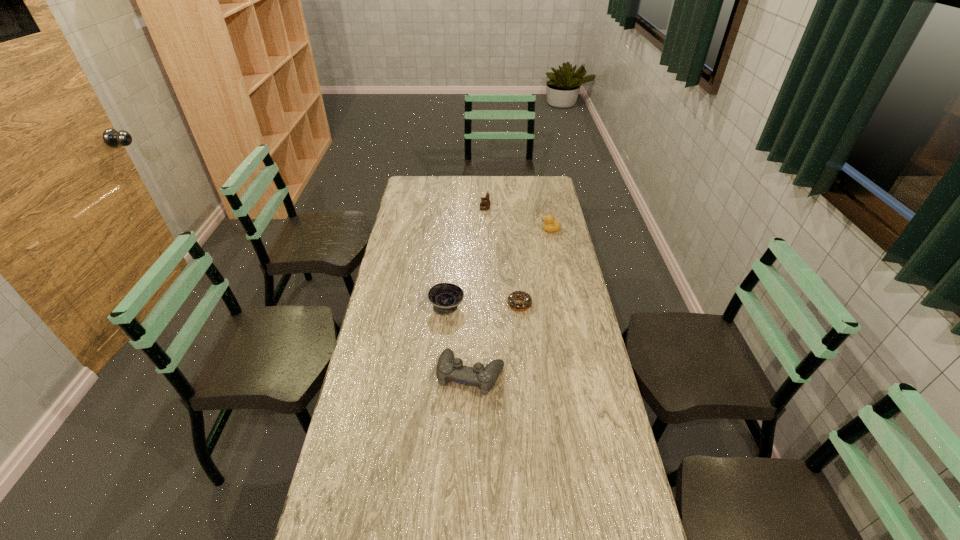
Locate an element on the screen. vacant space located on the face of the second farthest object is located at coordinates (530, 230).

Locate an element on the screen. This screenshot has height=540, width=960. vacant space located on the face of the second farthest object is located at coordinates (521, 230).

Identify the location of vacant space situated on the face of the second farthest object. (488, 230).

The width and height of the screenshot is (960, 540). I want to click on free space located 0.170m on the back of the control, so click(472, 317).

The width and height of the screenshot is (960, 540). Identify the location of vacant region located on the right of the bowl. (564, 306).

Image resolution: width=960 pixels, height=540 pixels. In order to click on free space located 0.100m on the back of the shortest object in this screenshot , I will do `click(517, 279)`.

At what (x,y) coordinates should I click in order to perform the action: click on object that is at the right edge. Please return your answer as a coordinate pair (x, y). Looking at the image, I should click on (549, 225).

Locate an element on the screen. The height and width of the screenshot is (540, 960). vacant space at the far edge is located at coordinates (498, 188).

The height and width of the screenshot is (540, 960). Identify the location of vacant space at the left edge. (390, 304).

Locate an element on the screen. This screenshot has width=960, height=540. free space at the far left corner of the desktop is located at coordinates (417, 179).